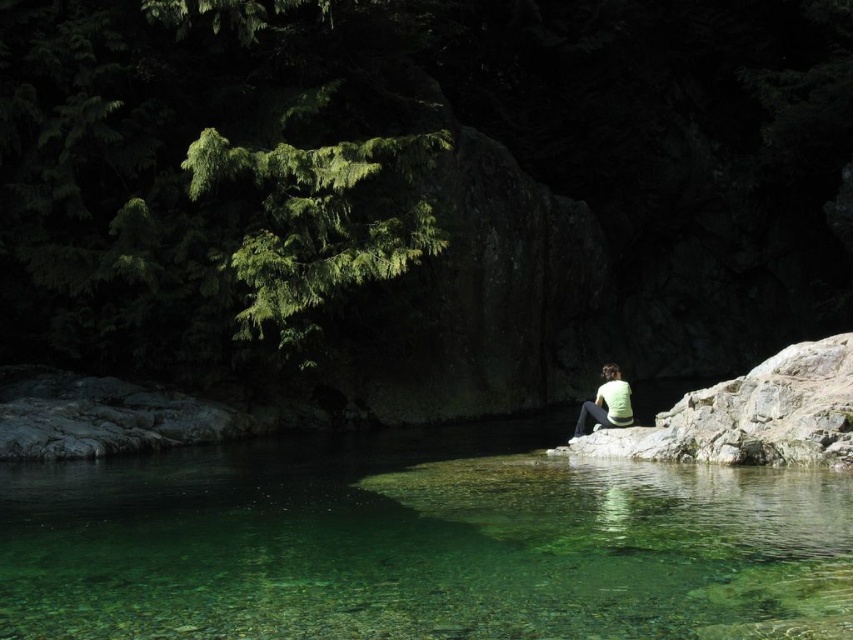
Between clear glassy water at center and green matte shirt at center, which one appears on the right side from the viewer's perspective?

green matte shirt at center

Is point (172, 502) positioned before point (601, 397)?

That is True.

What are the coordinates of `clear glassy water at center` in the screenshot? It's located at [x=421, y=544].